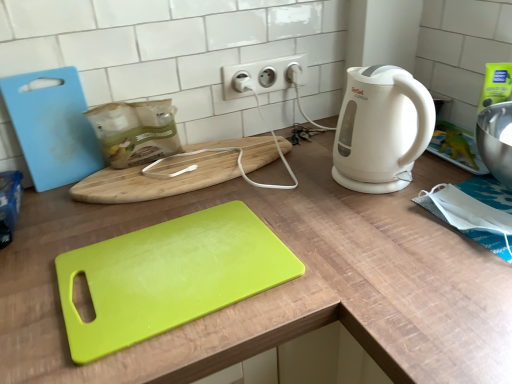
Question: Is wooden cutting board at center, marked as the 3th cutting board in a front-to-back arrangement, facing towards white matte electric kettle at right?

Choices:
 (A) yes
 (B) no

Answer: (B)

Question: Can you confirm if wooden cutting board at center, marked as the first cutting board in a back-to-front arrangement, is shorter than white matte electric kettle at right?

Choices:
 (A) yes
 (B) no

Answer: (A)

Question: Is white matte electric kettle at right completely or partially inside wooden cutting board at center, marked as the 3th cutting board in a front-to-back arrangement?

Choices:
 (A) no
 (B) yes

Answer: (A)

Question: Is wooden cutting board at center, marked as the first cutting board in a back-to-front arrangement, bigger than white matte electric kettle at right?

Choices:
 (A) no
 (B) yes

Answer: (A)

Question: From a real-world perspective, is wooden cutting board at center, marked as the first cutting board in a back-to-front arrangement, under white matte electric kettle at right?

Choices:
 (A) no
 (B) yes

Answer: (B)

Question: Looking at their shapes, would you say lime green plastic cutting board at center, the third cutting board from the back, is wider or thinner than wooden cutting board at center, marked as the first cutting board in a back-to-front arrangement?

Choices:
 (A) wide
 (B) thin

Answer: (A)

Question: Considering the positions of point (195, 213) and point (184, 163), is point (195, 213) closer or farther from the camera than point (184, 163)?

Choices:
 (A) farther
 (B) closer

Answer: (B)

Question: From the image's perspective, is lime green plastic cutting board at center, which appears as the first cutting board when viewed from the front, above or below wooden cutting board at center, marked as the first cutting board in a back-to-front arrangement?

Choices:
 (A) above
 (B) below

Answer: (B)

Question: Do you think lime green plastic cutting board at center, which appears as the first cutting board when viewed from the front, is within wooden cutting board at center, marked as the first cutting board in a back-to-front arrangement, or outside of it?

Choices:
 (A) inside
 (B) outside

Answer: (B)

Question: From their relative heights in the image, would you say white plastic electric outlet at upper center is taller or shorter than lime green plastic cutting board at center, the third cutting board from the back?

Choices:
 (A) short
 (B) tall

Answer: (B)

Question: Considering the positions of point (230, 74) and point (178, 324), is point (230, 74) closer or farther from the camera than point (178, 324)?

Choices:
 (A) closer
 (B) farther

Answer: (B)

Question: Looking at their shapes, would you say white plastic electric outlet at upper center is wider or thinner than lime green plastic cutting board at center, which appears as the first cutting board when viewed from the front?

Choices:
 (A) thin
 (B) wide

Answer: (A)

Question: From the image's perspective, is white plastic electric outlet at upper center located above or below lime green plastic cutting board at center, the third cutting board from the back?

Choices:
 (A) above
 (B) below

Answer: (A)

Question: In terms of height, does white plastic electric outlet at upper center look taller or shorter compared to light blue plastic cutting board at left, the 2th cutting board viewed from the front?

Choices:
 (A) short
 (B) tall

Answer: (A)

Question: From a real-world perspective, relative to light blue plastic cutting board at left, marked as the second cutting board in a back-to-front arrangement, is white plastic electric outlet at upper center vertically above or below?

Choices:
 (A) above
 (B) below

Answer: (A)